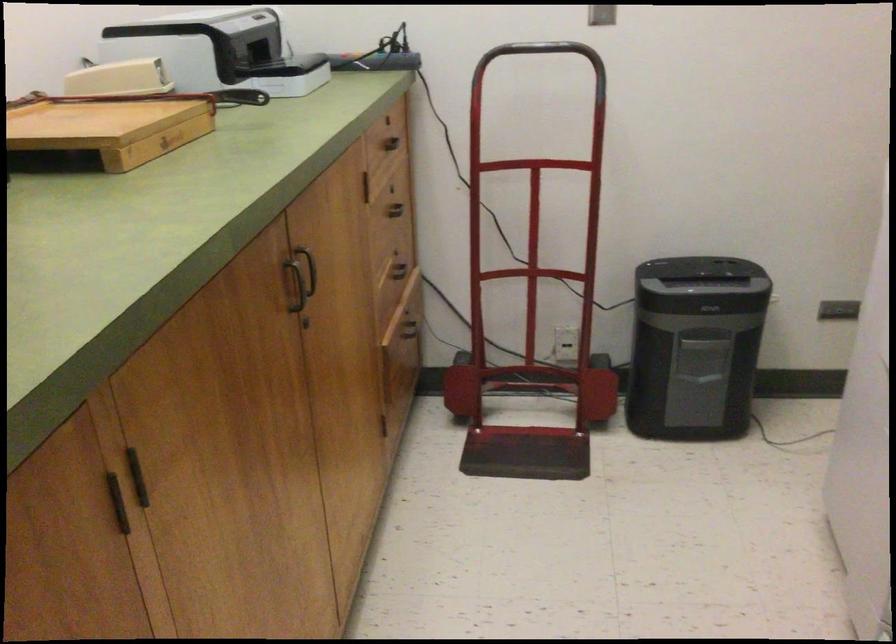
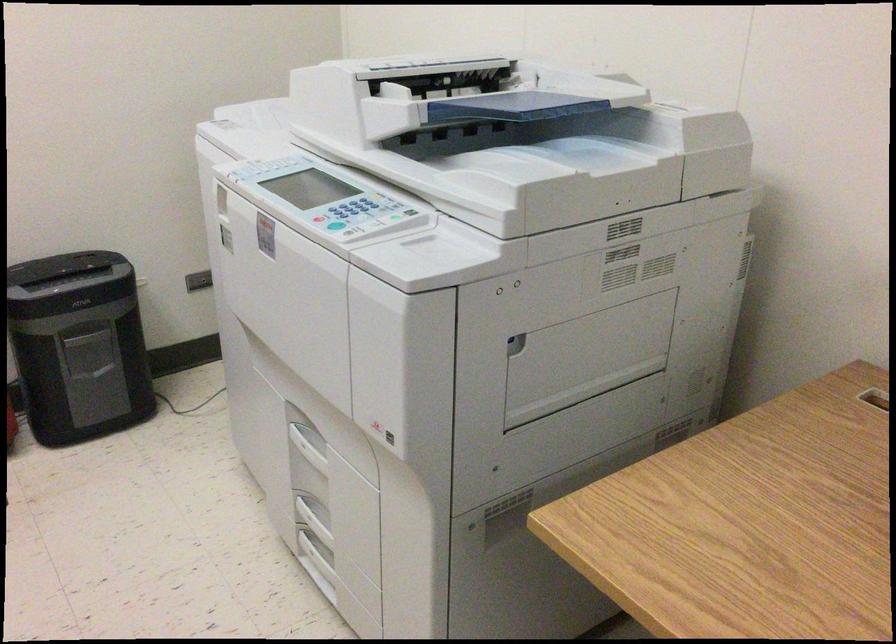
In the second image, find the point that corresponds to pixel 702 344 in the first image.

(79, 346)